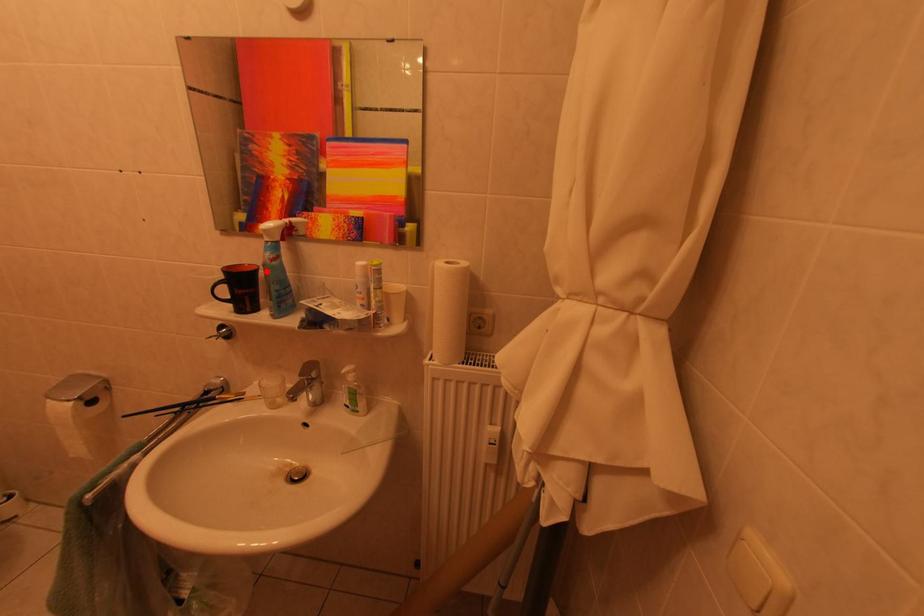
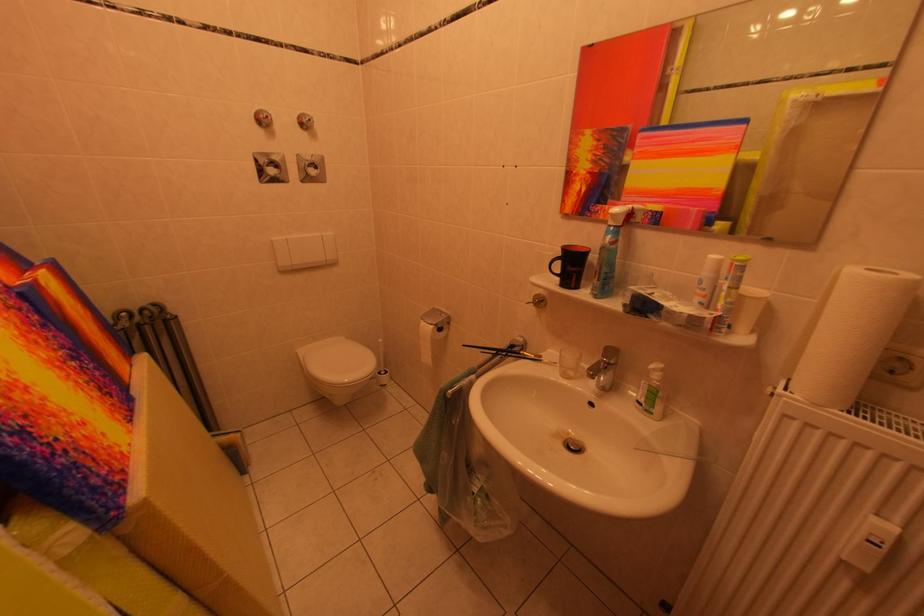
Locate, in the second image, the point that corresponds to the highlighted location in the first image.

(599, 253)